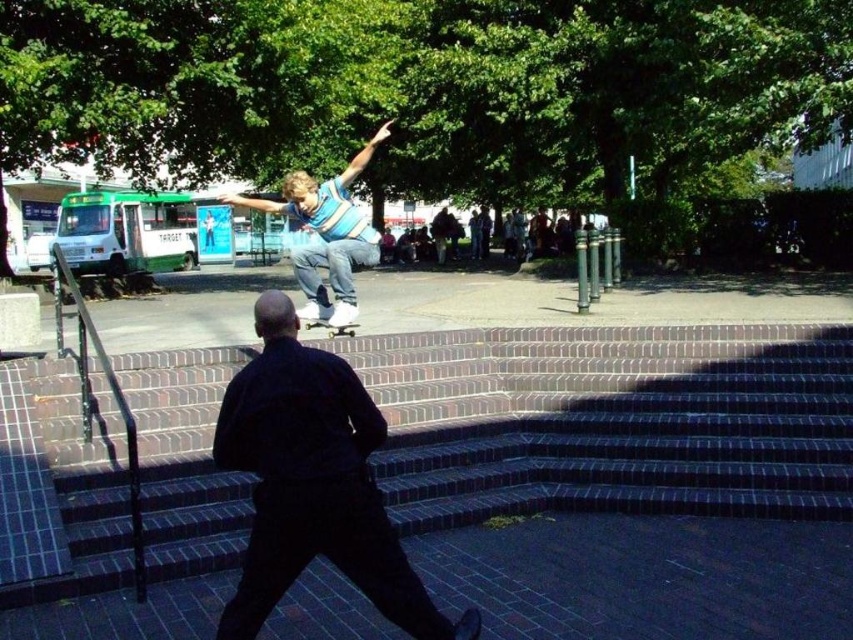
You are a drone operator trying to capture the skateboarder and the person walking away in a single shot. Given the coordinates of the dark brick stairs at center at point 0.658, 0.719, where should you position the camera to ensure both subjects are in frame?

The dark brick stairs at center are located at coordinates [612,420]. To capture both the skateboarder and the person walking away in a single shot, position the camera so that the dark brick stairs at center are centered. This will ensure both subjects are within the frame.

Based on the scene description, can you determine if the denim jeans at center are touching the wooden deck at center? Explain your reasoning using the provided information.

The denim jeans at center is above the wooden deck at center, so they are not touching it.

You are a photographer trying to capture the skateboarder in action. You notice a point at coordinates (x=312, y=483) in the image. What object is located at this point?

The point at coordinates (x=312, y=483) indicates the dark blue shirt at center.